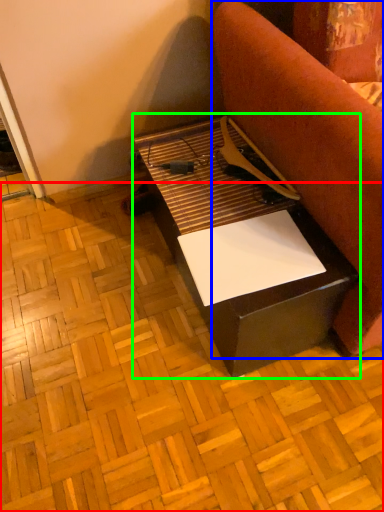
Question: Estimate the real-world distances between objects in this image. Which object is closer to plywood (highlighted by a red box), furniture (highlighted by a blue box) or table (highlighted by a green box)?

Choices:
 (A) furniture
 (B) table

Answer: (B)